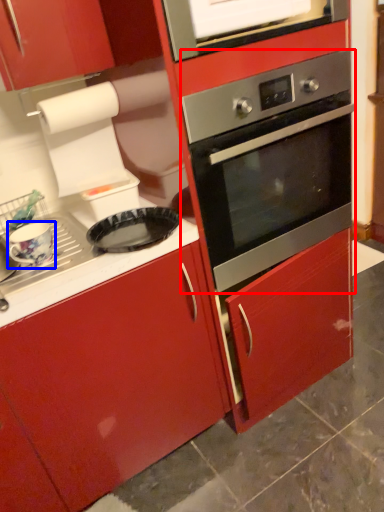
Question: Among these objects, which one is farthest to the camera, oven (highlighted by a red box) or appliance (highlighted by a blue box)?

Choices:
 (A) oven
 (B) appliance

Answer: (B)